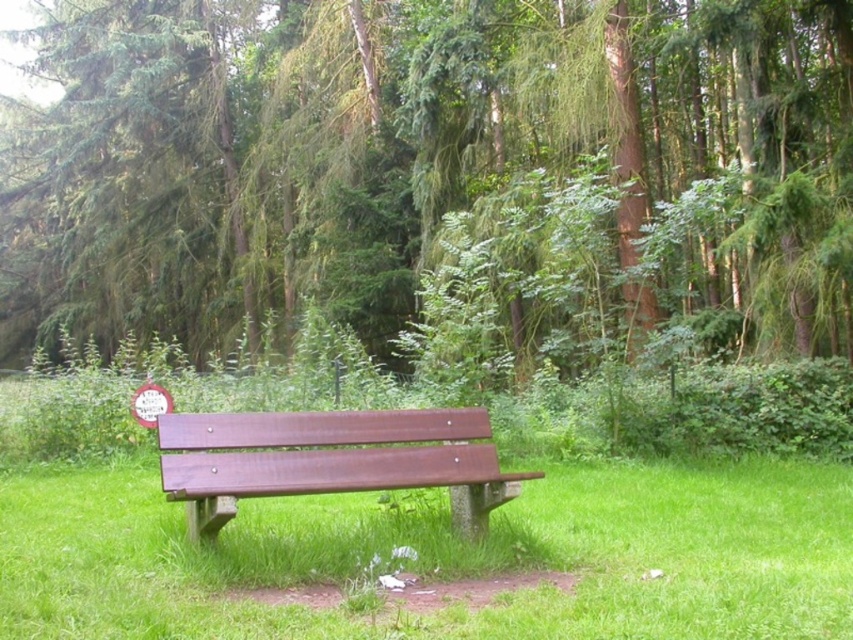
You are standing at the point marked by coordinates point (444, 556) in the image. What object are you standing on?

You are standing on the brown wood bench at center marked by point (444, 556).

You are standing at the point marked by the coordinates point (403, 148). Looking around, you see a wooden bench in the scene. Which direction should you walk to reach the wooden bench?

The point (403, 148) marks the green leafy tree at center. The wooden bench is located in the grassy area around the tree, so you should walk towards the direction where the bench is situated relative to the tree.